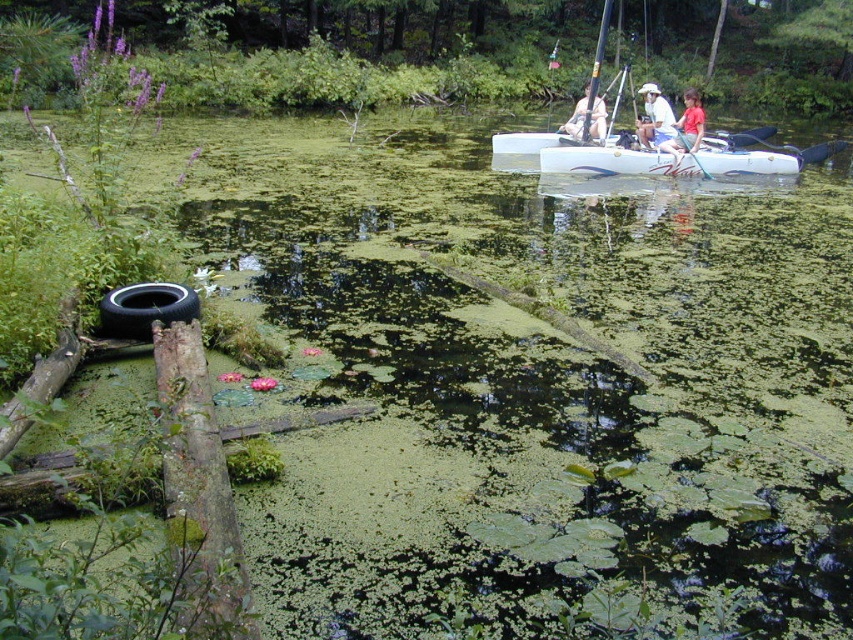
Who is higher up, black rubber tire at lower left or matte white kayak at upper center?

matte white kayak at upper center is higher up.

Who is taller, black rubber tire at lower left or matte white kayak at upper center?

matte white kayak at upper center

This screenshot has height=640, width=853. What do you see at coordinates (144, 308) in the screenshot?
I see `black rubber tire at lower left` at bounding box center [144, 308].

This screenshot has width=853, height=640. I want to click on black rubber tire at lower left, so click(144, 308).

Does white glossy kayak at upper center appear on the left side of black rubber tire at lower left?

No, white glossy kayak at upper center is not to the left of black rubber tire at lower left.

Can you confirm if white glossy kayak at upper center is positioned above black rubber tire at lower left?

Correct, white glossy kayak at upper center is located above black rubber tire at lower left.

Describe the element at coordinates (651, 148) in the screenshot. This screenshot has height=640, width=853. I see `white glossy kayak at upper center` at that location.

Locate an element on the screen. white glossy kayak at upper center is located at coordinates (651, 148).

Which is below, white glossy kayak at upper center or wooden paddle at center?

wooden paddle at center

Is white glossy kayak at upper center below wooden paddle at center?

Actually, white glossy kayak at upper center is above wooden paddle at center.

Measure the distance between point (809, 150) and camera.

A distance of 57.64 feet exists between point (809, 150) and camera.

Identify the location of white glossy kayak at upper center. [651, 148].